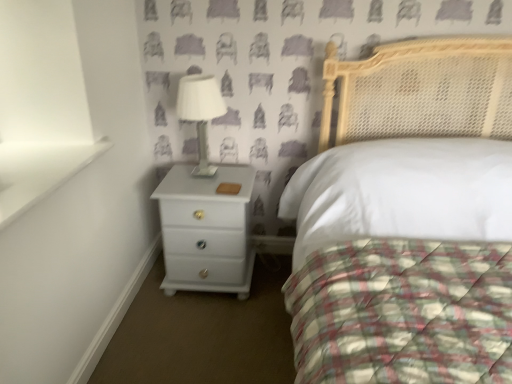
What do you see at coordinates (200, 112) in the screenshot? Image resolution: width=512 pixels, height=384 pixels. I see `white glossy table lamp at upper center` at bounding box center [200, 112].

Locate an element on the screen. The image size is (512, 384). white glossy bed at center is located at coordinates (403, 313).

At what (x,y) coordinates should I click in order to perform the action: click on white glossy table lamp at upper center. Please return your answer as a coordinate pair (x, y). Looking at the image, I should click on (200, 112).

Is white glossy chest of drawers at lower left oriented away from white glossy table lamp at upper center?

No, white glossy table lamp at upper center is not at the back of white glossy chest of drawers at lower left.

Based on their sizes in the image, would you say white glossy chest of drawers at lower left is bigger or smaller than white glossy table lamp at upper center?

Clearly, white glossy chest of drawers at lower left is larger in size than white glossy table lamp at upper center.

Identify the location of table lamp above the white glossy chest of drawers at lower left (from the image's perspective). Image resolution: width=512 pixels, height=384 pixels. (200, 112).

From the image's perspective, which is below, white glossy chest of drawers at lower left or white glossy table lamp at upper center?

white glossy chest of drawers at lower left, from the image's perspective.

Would you say white glossy table lamp at upper center is inside or outside white glossy chest of drawers at lower left?

white glossy table lamp at upper center exists outside the volume of white glossy chest of drawers at lower left.

Does white glossy table lamp at upper center have a smaller size compared to white glossy chest of drawers at lower left?

Yes, white glossy table lamp at upper center is smaller than white glossy chest of drawers at lower left.

This screenshot has height=384, width=512. In order to click on chest of drawers behind the white glossy table lamp at upper center in this screenshot , I will do `click(206, 230)`.

From the image's perspective, does white glossy bed at center appear lower than white glossy table lamp at upper center?

Yes.

Which of these two, white glossy bed at center or white glossy table lamp at upper center, is bigger?

white glossy bed at center is bigger.

Between point (327, 357) and point (212, 97), which one is positioned behind?

Positioned behind is point (212, 97).

Is white glossy bed at center not within white glossy table lamp at upper center?

That's correct, white glossy bed at center is outside of white glossy table lamp at upper center.

Find the location of a particular element. This screenshot has width=512, height=384. the chest of drawers located underneath the white glossy bed at center (from a real-world perspective) is located at coordinates (206, 230).

Measure the distance from white glossy bed at center to white glossy chest of drawers at lower left.

29.19 inches.

Is white glossy bed at center bigger than white glossy chest of drawers at lower left?

Correct, white glossy bed at center is larger in size than white glossy chest of drawers at lower left.

Is white glossy bed at center located outside white glossy chest of drawers at lower left?

Yes.

From a real-world perspective, is white glossy table lamp at upper center physically above white glossy bed at center?

Yes, from a real-world perspective, white glossy table lamp at upper center is on top of white glossy bed at center.

Is white glossy table lamp at upper center taller than white glossy bed at center?

No, white glossy table lamp at upper center is not taller than white glossy bed at center.

Visually, is white glossy table lamp at upper center positioned to the left or to the right of white glossy bed at center?

In the image, white glossy table lamp at upper center appears on the left side of white glossy bed at center.

Which of these two, white glossy chest of drawers at lower left or white glossy bed at center, stands shorter?

white glossy chest of drawers at lower left.

Based on the photo, which object is further away from the camera taking this photo, white glossy chest of drawers at lower left or white glossy bed at center?

white glossy chest of drawers at lower left is further away from the camera.

From the image's perspective, which one is positioned higher, white glossy chest of drawers at lower left or white glossy bed at center?

white glossy chest of drawers at lower left.

Looking at their sizes, would you say white glossy chest of drawers at lower left is wider or thinner than white glossy bed at center?

Considering their sizes, white glossy chest of drawers at lower left looks slimmer than white glossy bed at center.

In order to click on table lamp on the left of white glossy chest of drawers at lower left in this screenshot , I will do `click(200, 112)`.

Locate an element on the screen. The image size is (512, 384). table lamp in front of the white glossy chest of drawers at lower left is located at coordinates (200, 112).

Looking at the image, which one is located closer to white glossy chest of drawers at lower left, white glossy bed at center or white glossy table lamp at upper center?

Based on the image, white glossy table lamp at upper center appears to be nearer to white glossy chest of drawers at lower left.

Which object lies further to the anchor point white glossy bed at center, white glossy chest of drawers at lower left or white glossy table lamp at upper center?

white glossy table lamp at upper center is positioned further to the anchor white glossy bed at center.

Looking at the image, which one is located further to white glossy table lamp at upper center, white glossy bed at center or white glossy chest of drawers at lower left?

Among the two, white glossy bed at center is located further to white glossy table lamp at upper center.

Based on their spatial positions, is white glossy chest of drawers at lower left or white glossy bed at center further from white glossy table lamp at upper center?

white glossy bed at center is positioned further to the anchor white glossy table lamp at upper center.

Looking at the image, which one is located further to white glossy bed at center, white glossy table lamp at upper center or white glossy chest of drawers at lower left?

white glossy table lamp at upper center is positioned further to the anchor white glossy bed at center.

From the image, which object appears to be nearer to white glossy chest of drawers at lower left, white glossy table lamp at upper center or white glossy bed at center?

white glossy table lamp at upper center is positioned closer to the anchor white glossy chest of drawers at lower left.

Image resolution: width=512 pixels, height=384 pixels. Identify the location of table lamp between white glossy bed at center and white glossy chest of drawers at lower left along the z-axis. (200, 112).